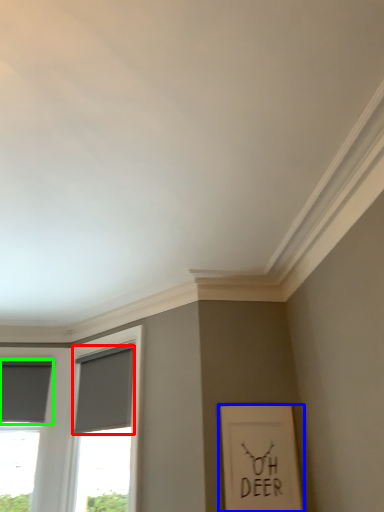
Question: Considering the real-world distances, which object is farthest from curtain (highlighted by a red box)? picture frame (highlighted by a blue box) or curtain (highlighted by a green box)?

Choices:
 (A) picture frame
 (B) curtain

Answer: (A)